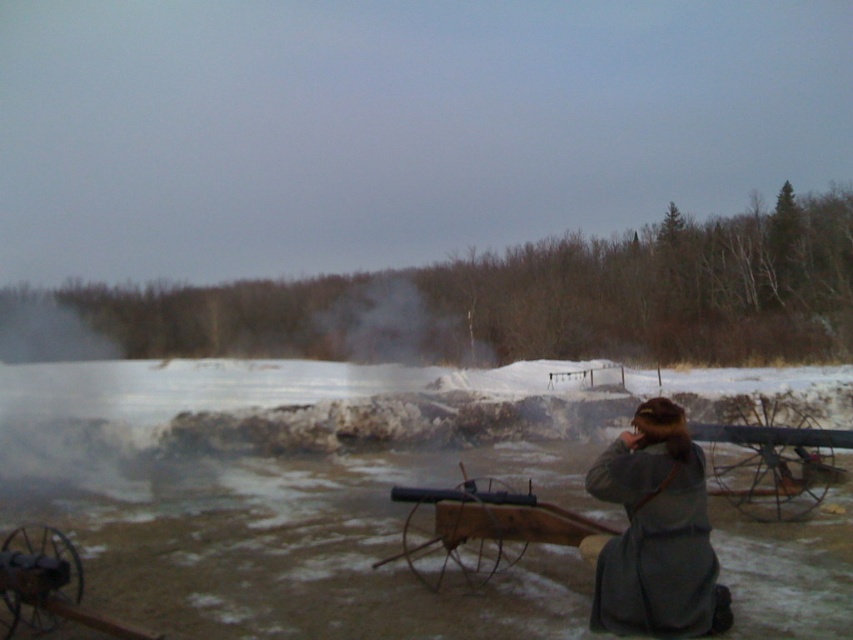
In the scene shown: Does gray wool coat at lower right have a lesser height compared to black matte cannon at lower left?

Incorrect, gray wool coat at lower right's height does not fall short of black matte cannon at lower left's.

Is gray wool coat at lower right below black matte cannon at lower left?

Actually, gray wool coat at lower right is above black matte cannon at lower left.

Where is `gray wool coat at lower right`? This screenshot has width=853, height=640. gray wool coat at lower right is located at coordinates (656, 532).